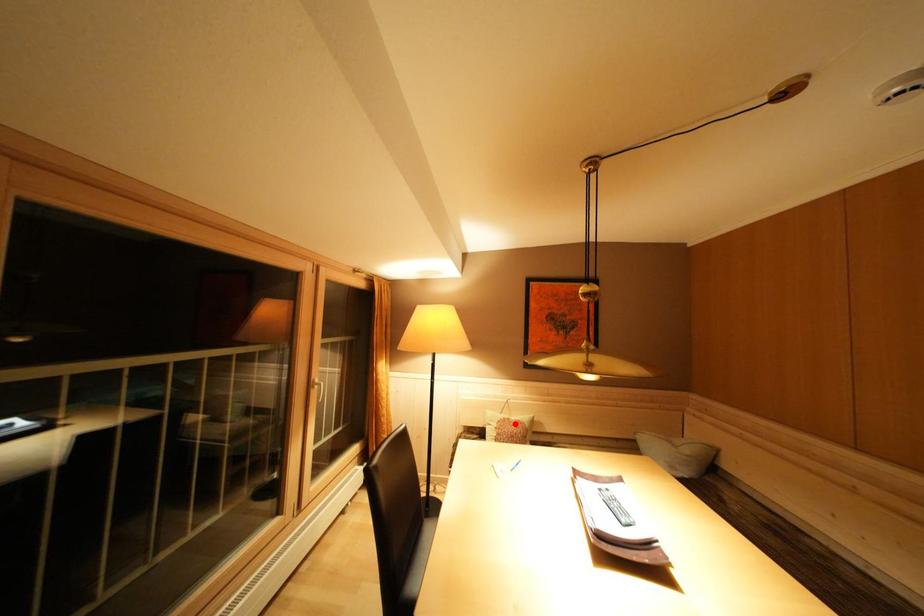
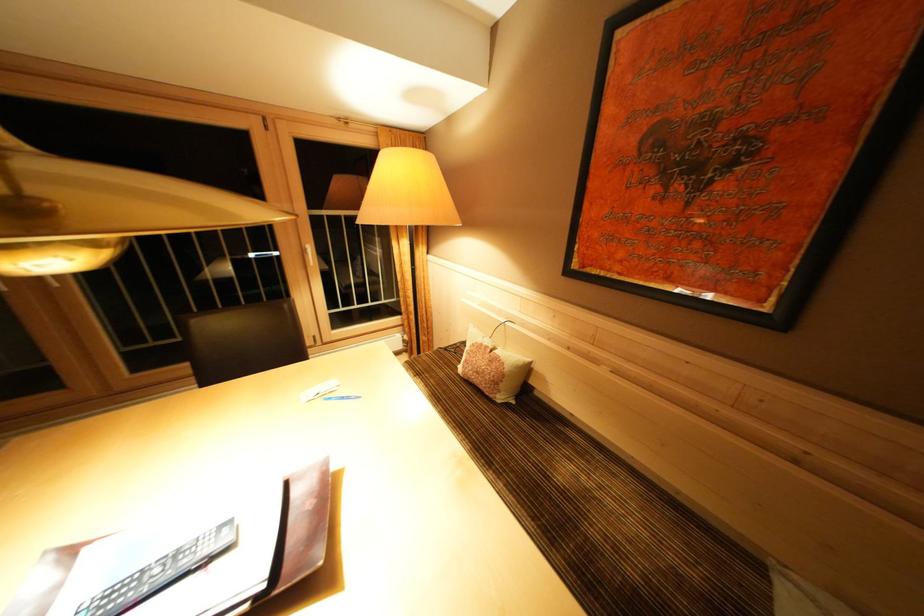
Question: I am providing you with two images of the same scene from different viewpoints. A red point is shown in image1. For the corresponding object point in image2, is it positioned nearer or farther from the camera?

Choices:
 (A) Nearer
 (B) Farther

Answer: (A)